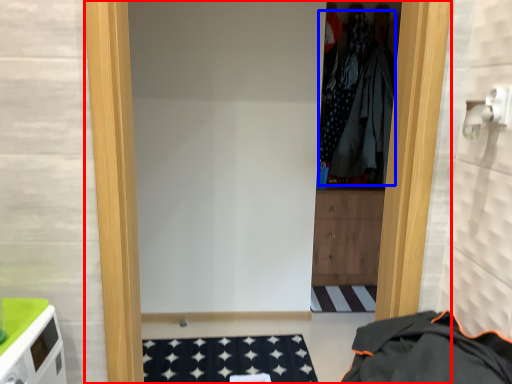
Question: Which object is further to the camera taking this photo, door (highlighted by a red box) or clothing (highlighted by a blue box)?

Choices:
 (A) door
 (B) clothing

Answer: (B)